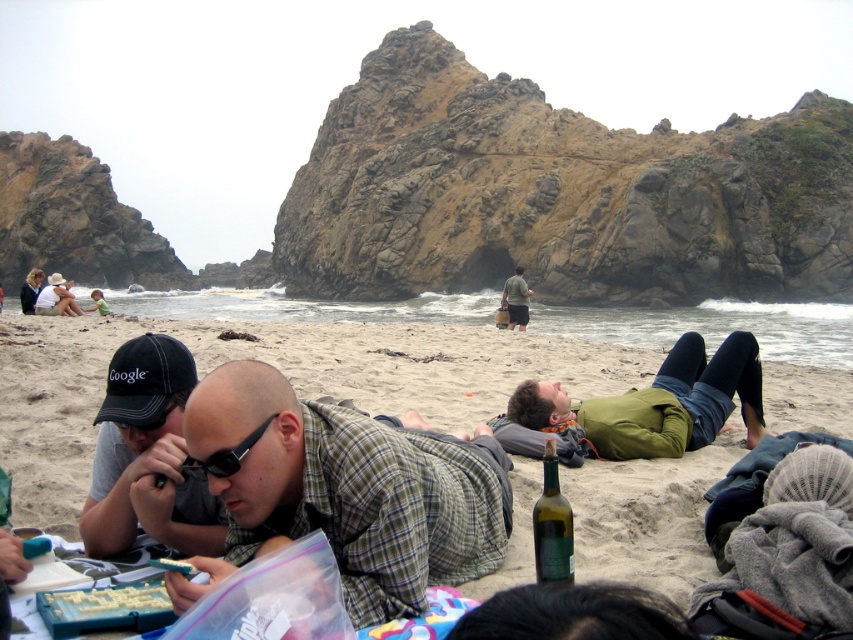
Looking at this image, you are a photographer standing at the shoreline. You want to take a photo of the black plastic sunglasses at center and the green fabric shirt at center. Which object should you focus on first if you want to capture both in the same frame without moving the camera?

You should focus on the black plastic sunglasses at center first since it is to the left of the green fabric shirt at center, allowing both to be in the same frame by centering the camera between them.

You are a photographer trying to capture a candid shot of the beach scene. You notice the black plastic sunglasses at center and the green fabric shirt at center. Which object is positioned closer to your camera lens?

The black plastic sunglasses at center is closer to the viewer than the green fabric shirt at center, so the sunglasses would appear closer to the camera lens.

You are a photographer standing at the shoreline. You want to take a photo of the dark gray fabric cap at lower left and the matte black jacket at upper left. Which object should you focus on first if you want to capture both in a single frame without moving the camera?

The dark gray fabric cap at lower left is to the right of the matte black jacket at upper left, so you should focus on the matte black jacket at upper left first as it is closer to the left side of the frame.